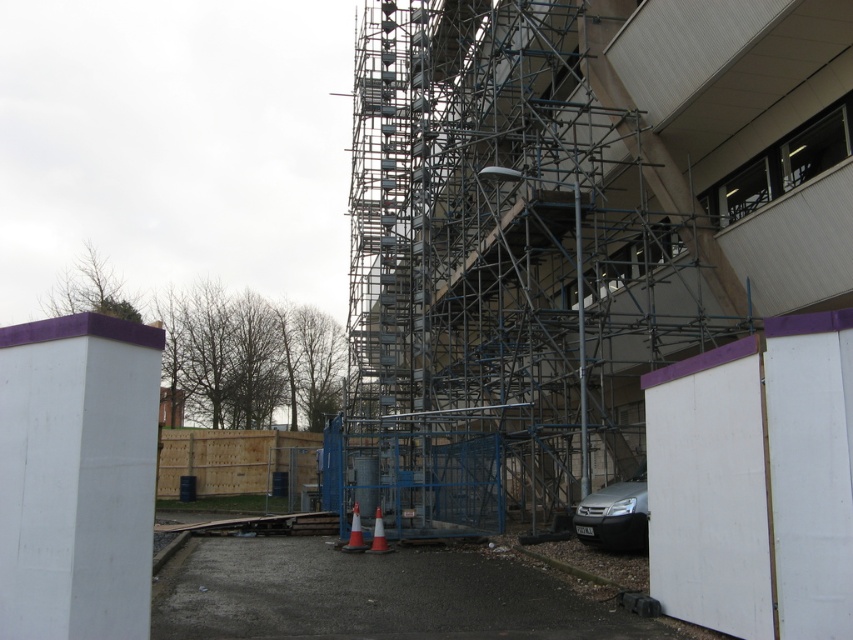
Can you confirm if metal scaffolding at center is taller than orange reflective cone at lower center?

Yes.

Can you confirm if metal scaffolding at center is thinner than orange reflective cone at lower center?

In fact, metal scaffolding at center might be wider than orange reflective cone at lower center.

Is point (601, 76) closer to viewer compared to point (341, 548)?

No, (601, 76) is further to viewer.

Where is `metal scaffolding at center`? The height and width of the screenshot is (640, 853). metal scaffolding at center is located at coordinates (509, 264).

Is satin silver car at lower right positioned before orange plastic cone at lower center?

Yes, satin silver car at lower right is closer to the viewer.

Which is in front, point (607, 547) or point (376, 509)?

Point (607, 547) is in front.

Where is `satin silver car at lower right`? satin silver car at lower right is located at coordinates (614, 515).

Can you confirm if metal scaffolding at center is positioned to the right of satin silver car at lower right?

In fact, metal scaffolding at center is to the left of satin silver car at lower right.

Does metal scaffolding at center have a greater width compared to satin silver car at lower right?

Yes, metal scaffolding at center is wider than satin silver car at lower right.

Where is `metal scaffolding at center`? This screenshot has height=640, width=853. metal scaffolding at center is located at coordinates (509, 264).